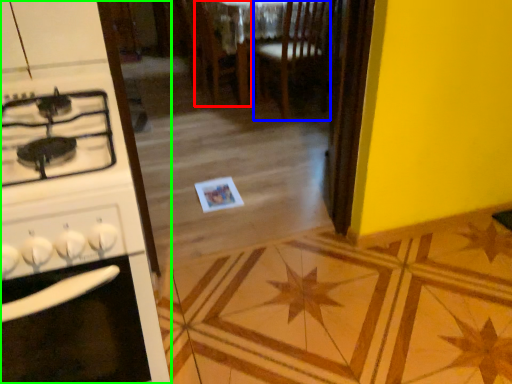
Question: Which is farther away from chair (highlighted by a red box)? chair (highlighted by a blue box) or kitchen appliance (highlighted by a green box)?

Choices:
 (A) chair
 (B) kitchen appliance

Answer: (B)